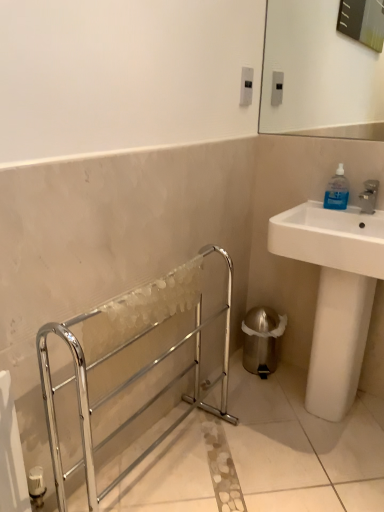
Question: Is blue translucent bottle at upper right next to white glossy sink at right and touching it?

Choices:
 (A) no
 (B) yes

Answer: (A)

Question: Does blue translucent bottle at upper right appear on the right side of white glossy sink at right?

Choices:
 (A) no
 (B) yes

Answer: (A)

Question: Is blue translucent bottle at upper right oriented towards white glossy sink at right?

Choices:
 (A) yes
 (B) no

Answer: (A)

Question: Is blue translucent bottle at upper right further to the viewer compared to white glossy sink at right?

Choices:
 (A) no
 (B) yes

Answer: (B)

Question: Is blue translucent bottle at upper right positioned in front of white glossy sink at right?

Choices:
 (A) no
 (B) yes

Answer: (A)

Question: From the image's perspective, is chrome metallic towel rack at left above or below white glossy sink at right?

Choices:
 (A) below
 (B) above

Answer: (A)

Question: In terms of size, does chrome metallic towel rack at left appear bigger or smaller than white glossy sink at right?

Choices:
 (A) big
 (B) small

Answer: (B)

Question: Would you say chrome metallic towel rack at left is to the left or to the right of white glossy sink at right in the picture?

Choices:
 (A) right
 (B) left

Answer: (B)

Question: Considering the positions of chrome metallic towel rack at left and white glossy sink at right in the image, is chrome metallic towel rack at left wider or thinner than white glossy sink at right?

Choices:
 (A) thin
 (B) wide

Answer: (A)

Question: Considering the relative positions of white glossy sink at right and blue translucent bottle at upper right in the image provided, is white glossy sink at right to the left or to the right of blue translucent bottle at upper right?

Choices:
 (A) right
 (B) left

Answer: (A)

Question: From a real-world perspective, is white glossy sink at right positioned above or below blue translucent bottle at upper right?

Choices:
 (A) below
 (B) above

Answer: (A)

Question: Would you say white glossy sink at right is inside or outside blue translucent bottle at upper right?

Choices:
 (A) inside
 (B) outside

Answer: (B)

Question: Does point (379, 251) appear closer or farther from the camera than point (339, 192)?

Choices:
 (A) closer
 (B) farther

Answer: (A)

Question: Is chrome metallic towel rack at left in front of or behind blue translucent bottle at upper right in the image?

Choices:
 (A) front
 (B) behind

Answer: (A)

Question: Is chrome metallic towel rack at left bigger or smaller than blue translucent bottle at upper right?

Choices:
 (A) big
 (B) small

Answer: (A)